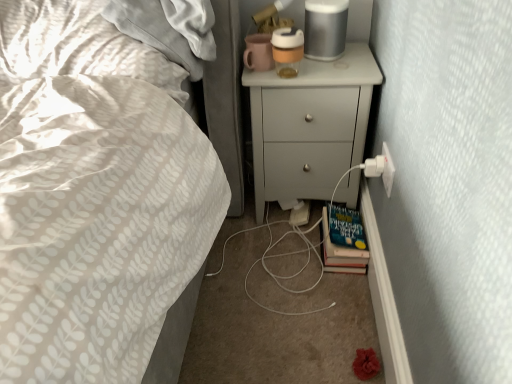
Locate an element on the screen. The height and width of the screenshot is (384, 512). free space above hardcover book at lower right (from a real-world perspective) is located at coordinates (342, 217).